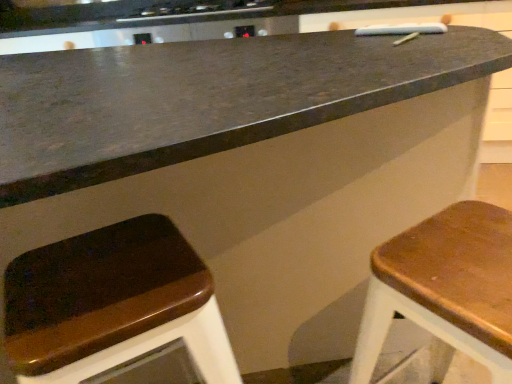
What is the approximate width of black glass stove at upper center?

21.07 inches.

You are a GUI agent. You are given a task and a screenshot of the screen. Output one action in this format:
    pyautogui.click(x=<x>, y=<y>)
    Task: Click on the wooden seat at right, arranged as the 1th stool when viewed from the right
    
    Given the screenshot: What is the action you would take?
    pyautogui.click(x=445, y=287)

You are a GUI agent. You are given a task and a screenshot of the screen. Output one action in this format:
    pyautogui.click(x=<x>, y=<y>)
    Task: Click on the black glass stove at upper center
    The image size is (512, 384).
    Given the screenshot: What is the action you would take?
    pyautogui.click(x=200, y=9)

Is wooden seat at right, the 2th stool positioned from the left, located within wooden seat at lower left, the 1th stool viewed from the left?

No, wooden seat at right, the 2th stool positioned from the left, is not surrounded by wooden seat at lower left, the 1th stool viewed from the left.

From a real-world perspective, which object stands above the other?

wooden seat at right, the 2th stool positioned from the left, is physically above.

Considering the sizes of objects wooden seat at lower left, the 1th stool viewed from the left, and wooden seat at right, arranged as the 1th stool when viewed from the right, in the image provided, who is taller, wooden seat at lower left, the 1th stool viewed from the left, or wooden seat at right, arranged as the 1th stool when viewed from the right,?

With more height is wooden seat at lower left, the 1th stool viewed from the left.

Is point (103, 341) positioned after point (486, 212)?

No, it is not.

From a real-world perspective, between wooden seat at right, arranged as the 1th stool when viewed from the right, and wooden seat at lower left, the 2th stool positioned from the right, who is vertically higher?

wooden seat at right, arranged as the 1th stool when viewed from the right, from a real-world perspective.

From the image's perspective, who appears lower, wooden seat at right, arranged as the 1th stool when viewed from the right, or wooden seat at lower left, the 2th stool positioned from the right?

wooden seat at lower left, the 2th stool positioned from the right, from the image's perspective.

What's the angular difference between wooden seat at right, arranged as the 1th stool when viewed from the right, and wooden seat at lower left, the 1th stool viewed from the left,'s facing directions?

The facing directions of wooden seat at right, arranged as the 1th stool when viewed from the right, and wooden seat at lower left, the 1th stool viewed from the left, are 6.12 degrees apart.

Considering the positions of points (446, 300) and (80, 269), is point (446, 300) closer to camera compared to point (80, 269)?

Yes, it is in front of point (80, 269).

Which is farther from the camera, (367, 366) or (154, 18)?

Point (154, 18)

Considering the relative positions of wooden seat at right, arranged as the 1th stool when viewed from the right, and black glass stove at upper center in the image provided, is wooden seat at right, arranged as the 1th stool when viewed from the right, to the left of black glass stove at upper center from the viewer's perspective?

Incorrect, wooden seat at right, arranged as the 1th stool when viewed from the right, is not on the left side of black glass stove at upper center.

Find the location of a particular element. The image size is (512, 384). the 2nd stool in front of the black glass stove at upper center, counting from the anchor's position is located at coordinates (x=445, y=287).

Measure the distance between wooden seat at right, the 2th stool positioned from the left, and black glass stove at upper center.

The distance of wooden seat at right, the 2th stool positioned from the left, from black glass stove at upper center is 2.01 meters.

Considering the sizes of wooden seat at lower left, the 2th stool positioned from the right, and black glass stove at upper center in the image, is wooden seat at lower left, the 2th stool positioned from the right, bigger or smaller than black glass stove at upper center?

wooden seat at lower left, the 2th stool positioned from the right, is bigger than black glass stove at upper center.

Can you confirm if wooden seat at lower left, the 2th stool positioned from the right, is taller than black glass stove at upper center?

Correct, wooden seat at lower left, the 2th stool positioned from the right, is much taller as black glass stove at upper center.

Based on the photo, from the image's perspective, is wooden seat at lower left, the 1th stool viewed from the left, located above or below black glass stove at upper center?

From the image's perspective, wooden seat at lower left, the 1th stool viewed from the left, appears below black glass stove at upper center.

Is black glass stove at upper center located within wooden seat at lower left, the 2th stool positioned from the right?

No, black glass stove at upper center is located outside of wooden seat at lower left, the 2th stool positioned from the right.

Would you say black glass stove at upper center contains wooden seat at lower left, the 1th stool viewed from the left?

That's incorrect, wooden seat at lower left, the 1th stool viewed from the left, is not inside black glass stove at upper center.

Are black glass stove at upper center and wooden seat at lower left, the 1th stool viewed from the left, located far from each other?

Indeed, black glass stove at upper center is not near wooden seat at lower left, the 1th stool viewed from the left.

Between point (260, 7) and point (56, 363), which one is positioned in front?

Positioned in front is point (56, 363).

At what (x,y) coordinates should I click in order to perform the action: click on stove behind the wooden seat at lower left, the 1th stool viewed from the left. Please return your answer as a coordinate pair (x, y). Image resolution: width=512 pixels, height=384 pixels. Looking at the image, I should click on (200, 9).

From the image's perspective, is black glass stove at upper center over wooden seat at right, the 2th stool positioned from the left?

Correct, black glass stove at upper center appears higher than wooden seat at right, the 2th stool positioned from the left, in the image.

Considering the positions of objects black glass stove at upper center and wooden seat at right, arranged as the 1th stool when viewed from the right, in the image provided, who is more to the left, black glass stove at upper center or wooden seat at right, arranged as the 1th stool when viewed from the right,?

Positioned to the left is black glass stove at upper center.

Considering the relative sizes of black glass stove at upper center and wooden seat at right, the 2th stool positioned from the left, in the image provided, is black glass stove at upper center bigger than wooden seat at right, the 2th stool positioned from the left,?

No, black glass stove at upper center is not bigger than wooden seat at right, the 2th stool positioned from the left.

Is black glass stove at upper center far from wooden seat at right, the 2th stool positioned from the left?

Absolutely, black glass stove at upper center is distant from wooden seat at right, the 2th stool positioned from the left.

At what (x,y) coordinates should I click in order to perform the action: click on stool on the right side of wooden seat at lower left, the 1th stool viewed from the left. Please return your answer as a coordinate pair (x, y). The height and width of the screenshot is (384, 512). Looking at the image, I should click on (445, 287).

At what (x,y) coordinates should I click in order to perform the action: click on stool lying behind the wooden seat at right, arranged as the 1th stool when viewed from the right. Please return your answer as a coordinate pair (x, y). The height and width of the screenshot is (384, 512). Looking at the image, I should click on (112, 304).

Considering their positions, is wooden seat at lower left, the 2th stool positioned from the right, positioned further to wooden seat at right, arranged as the 1th stool when viewed from the right, than black glass stove at upper center?

Based on the image, black glass stove at upper center appears to be further to wooden seat at right, arranged as the 1th stool when viewed from the right.

Which object lies nearer to the anchor point black glass stove at upper center, wooden seat at right, the 2th stool positioned from the left, or wooden seat at lower left, the 2th stool positioned from the right?

wooden seat at lower left, the 2th stool positioned from the right, is positioned closer to the anchor black glass stove at upper center.

Looking at the image, which one is located closer to wooden seat at lower left, the 2th stool positioned from the right, black glass stove at upper center or wooden seat at right, the 2th stool positioned from the left?

The object closer to wooden seat at lower left, the 2th stool positioned from the right, is wooden seat at right, the 2th stool positioned from the left.

Estimate the real-world distances between objects in this image. Which object is closer to wooden seat at right, arranged as the 1th stool when viewed from the right, black glass stove at upper center or wooden seat at lower left, the 1th stool viewed from the left?

wooden seat at lower left, the 1th stool viewed from the left, is closer to wooden seat at right, arranged as the 1th stool when viewed from the right.

Based on their spatial positions, is wooden seat at lower left, the 1th stool viewed from the left, or wooden seat at right, arranged as the 1th stool when viewed from the right, closer to black glass stove at upper center?

Based on the image, wooden seat at lower left, the 1th stool viewed from the left, appears to be nearer to black glass stove at upper center.

Which object lies nearer to the anchor point wooden seat at lower left, the 2th stool positioned from the right, wooden seat at right, the 2th stool positioned from the left, or black glass stove at upper center?

wooden seat at right, the 2th stool positioned from the left.

Identify the location of stool between wooden seat at right, the 2th stool positioned from the left, and black glass stove at upper center from front to back. (112, 304).